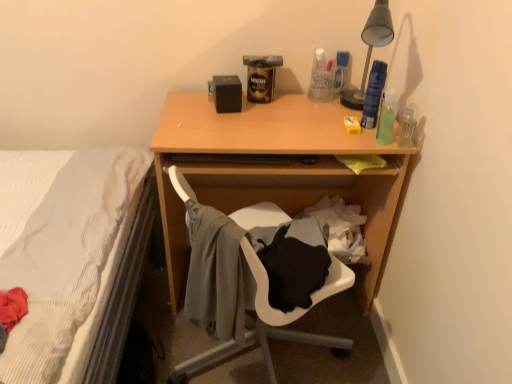
Question: From their relative heights in the image, would you say translucent plastic bottle at upper right, which is the fourth bottle from front to back, is taller or shorter than clear plastic bottle at right, which is the 3th bottle in back-to-front order?

Choices:
 (A) tall
 (B) short

Answer: (A)

Question: From a real-world perspective, relative to clear plastic bottle at right, the second bottle from the front, is translucent plastic bottle at upper right, placed as the 1th bottle when sorted from back to front, vertically above or below?

Choices:
 (A) below
 (B) above

Answer: (B)

Question: Which object is positioned farthest from the wooden desk at center?

Choices:
 (A) translucent green bottle at right, marked as the 1th bottle in a front-to-back arrangement
 (B) clear plastic bottle at right, the second bottle from the front
 (C) translucent plastic bottle at upper right, which is the fourth bottle from front to back
 (D) gray fabric chair at lower center
 (E) black matte speaker at upper center

Answer: (B)

Question: Which object is the farthest from the translucent plastic bottle at upper right, placed as the 1th bottle when sorted from back to front?

Choices:
 (A) wooden desk at center
 (B) gray fabric chair at lower center
 (C) translucent plastic spray can at upper right, marked as the 3th bottle in a front-to-back arrangement
 (D) translucent green bottle at right, marked as the 1th bottle in a front-to-back arrangement
 (E) clear plastic bottle at right, the second bottle from the front

Answer: (B)